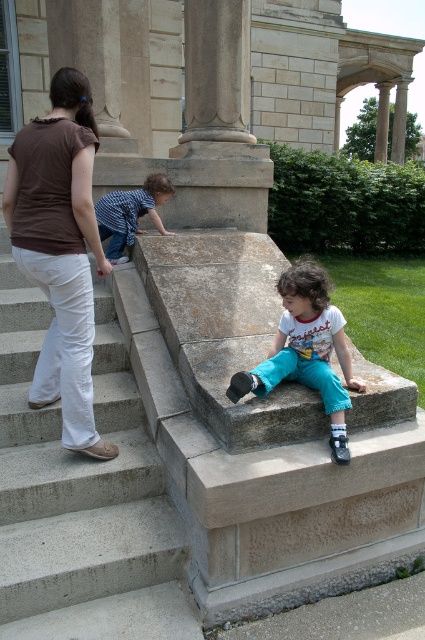
Which is behind, point (317, 380) or point (235, 67)?

The point (235, 67) is behind.

Who is taller, teal cotton pants at lower center or smooth stone column at center?

smooth stone column at center is taller.

Who is more distant from viewer, (295,305) or (246,28)?

The point (246,28) is behind.

In order to click on teal cotton pants at lower center in this screenshot , I will do `click(306, 349)`.

Which is behind, point (39, 630) or point (308, 385)?

Positioned behind is point (308, 385).

Does concrete stairs at center have a larger size compared to teal cotton pants at lower center?

Correct, concrete stairs at center is larger in size than teal cotton pants at lower center.

What do you see at coordinates (82, 496) in the screenshot? The image size is (425, 640). I see `concrete stairs at center` at bounding box center [82, 496].

The image size is (425, 640). I want to click on concrete stairs at center, so click(82, 496).

This screenshot has height=640, width=425. In order to click on brown cotton shirt at upper left in this screenshot , I will do `click(59, 250)`.

Between brown cotton shirt at upper left and smooth stone column at center, which one is positioned higher?

Positioned higher is smooth stone column at center.

Where is `brown cotton shirt at upper left`? Image resolution: width=425 pixels, height=640 pixels. brown cotton shirt at upper left is located at coordinates (59, 250).